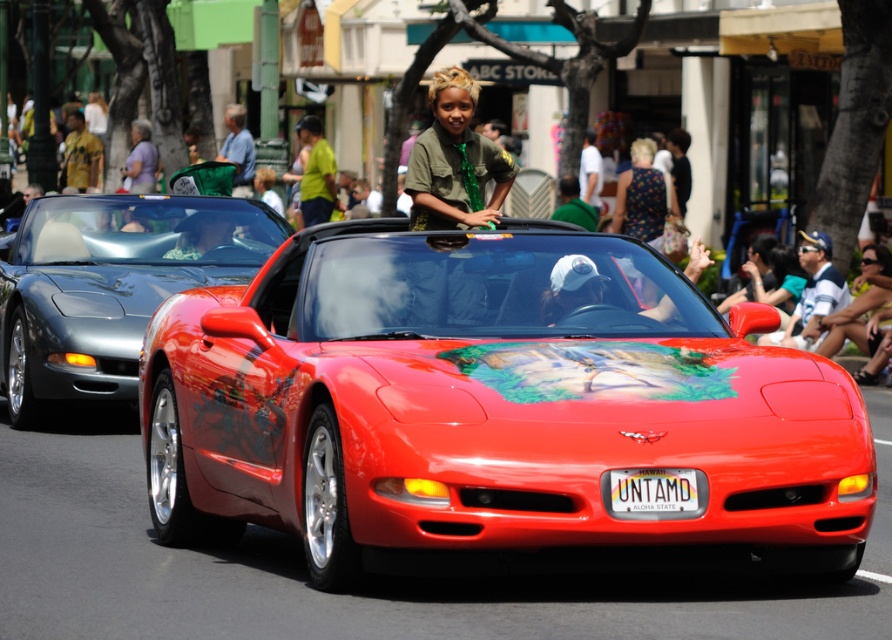
Question: Where is shiny red convertible at center located in relation to green fabric shirt at center in the image?

Choices:
 (A) above
 (B) below

Answer: (B)

Question: Estimate the real-world distances between objects in this image. Which object is farther from the shiny red convertible at center?

Choices:
 (A) white plastic license plate at center
 (B) shiny metallic car at left

Answer: (B)

Question: Estimate the real-world distances between objects in this image. Which object is farther from the green fabric shirt at center?

Choices:
 (A) shiny red convertible at center
 (B) shiny metallic car at left

Answer: (A)

Question: Is shiny metallic car at left bigger than white plastic license plate at center?

Choices:
 (A) yes
 (B) no

Answer: (A)

Question: Which point is farther to the camera?

Choices:
 (A) shiny red convertible at center
 (B) white plastic license plate at center
 (C) shiny metallic car at left

Answer: (C)

Question: Does shiny metallic car at left have a smaller size compared to green fabric shirt at center?

Choices:
 (A) yes
 (B) no

Answer: (B)